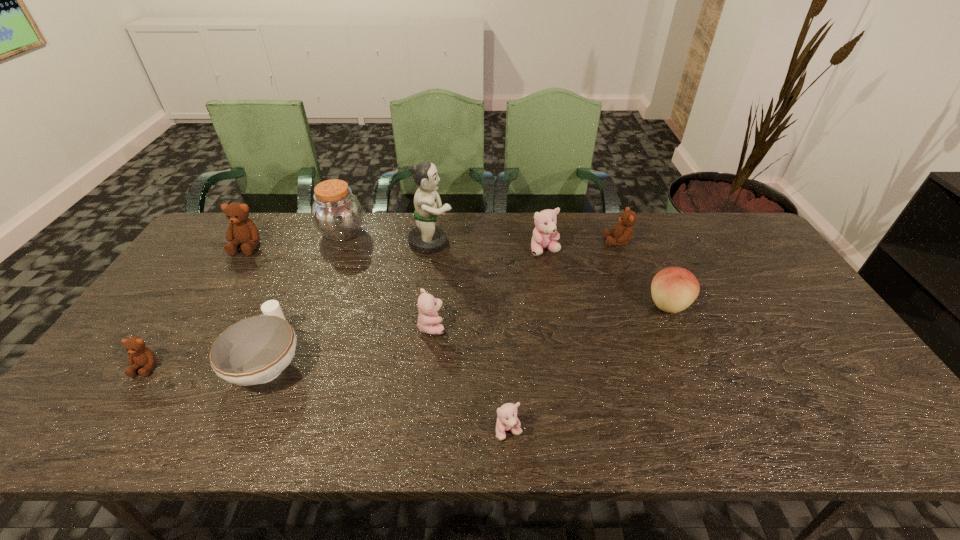
Locate an element on the screen. jar that is at the far edge is located at coordinates (337, 214).

You are a GUI agent. You are given a task and a screenshot of the screen. Output one action in this format:
    pyautogui.click(x=<x>, y=<y>)
    Task: Click on the object located at the near edge
    
    Given the screenshot: What is the action you would take?
    pyautogui.click(x=507, y=420)

You are a GUI agent. You are given a task and a screenshot of the screen. Output one action in this format:
    pyautogui.click(x=<x>, y=<y>)
    Task: Click on the object positioned at the far left corner
    This screenshot has width=960, height=540.
    Given the screenshot: What is the action you would take?
    pyautogui.click(x=242, y=230)

At what (x,y) coordinates should I click in order to perform the action: click on vacant space at the far edge of the desktop. Please return your answer as a coordinate pair (x, y). This screenshot has width=960, height=540. Looking at the image, I should click on (444, 222).

The image size is (960, 540). What are the coordinates of `vacant region at the near edge of the desktop` in the screenshot? It's located at (577, 430).

The height and width of the screenshot is (540, 960). In order to click on vacant region at the right edge in this screenshot , I will do `click(733, 272)`.

At what (x,y) coordinates should I click in order to perform the action: click on free space at the near left corner of the desktop. Please return your answer as a coordinate pair (x, y). Looking at the image, I should click on click(114, 441).

This screenshot has height=540, width=960. I want to click on vacant space at the far right corner of the desktop, so click(x=739, y=229).

Where is `unoccupied area between the peach and the biggest brown teddy bear`? This screenshot has height=540, width=960. unoccupied area between the peach and the biggest brown teddy bear is located at coordinates click(x=458, y=275).

This screenshot has height=540, width=960. What are the coordinates of `unoccupied position between the biggest brown teddy bear and the peach` in the screenshot? It's located at (458, 275).